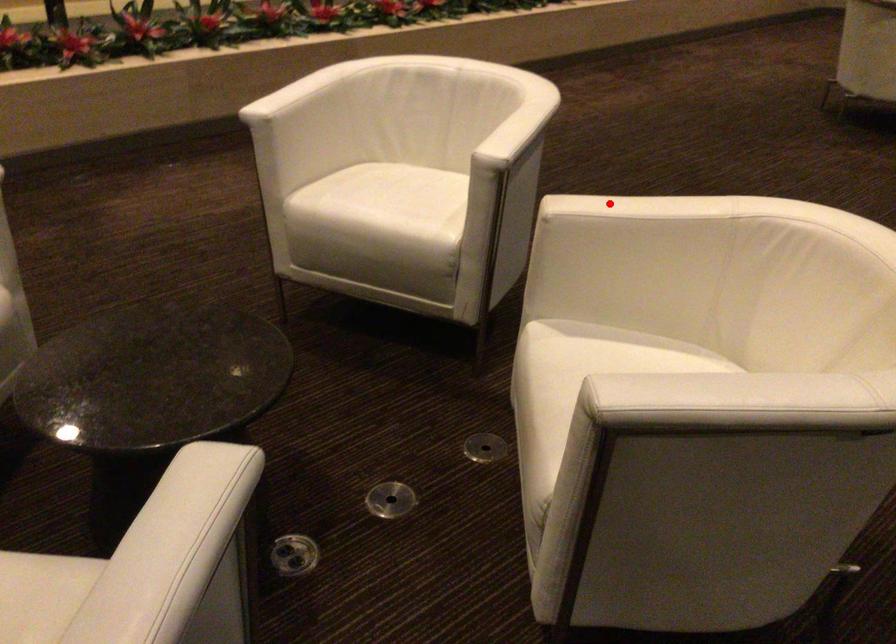
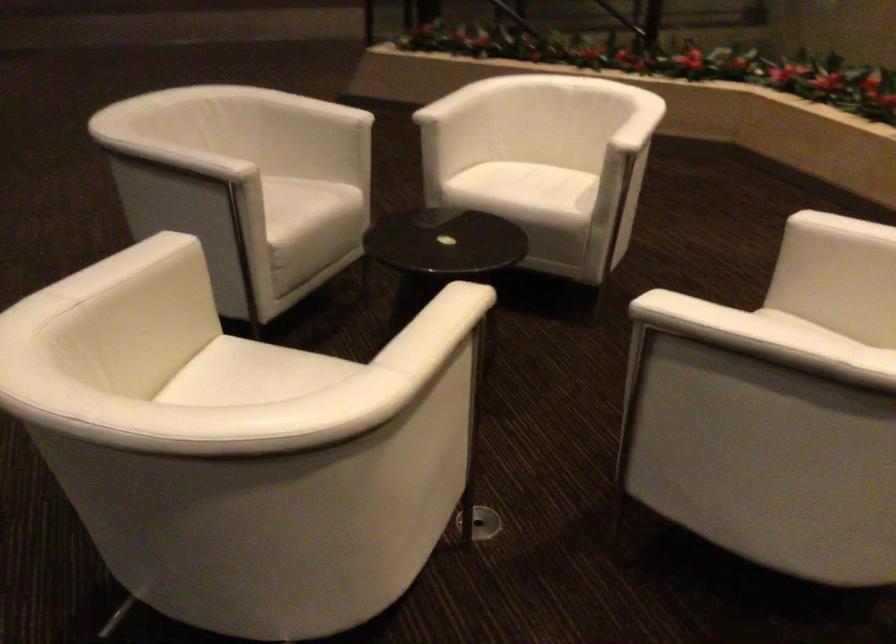
Question: A red point is marked in image1. In image2, is the corresponding 3D point closer to the camera or farther? Reply with the corresponding letter.

Choices:
 (A) The corresponding 3D point is closer.
 (B) The corresponding 3D point is farther.

Answer: (A)